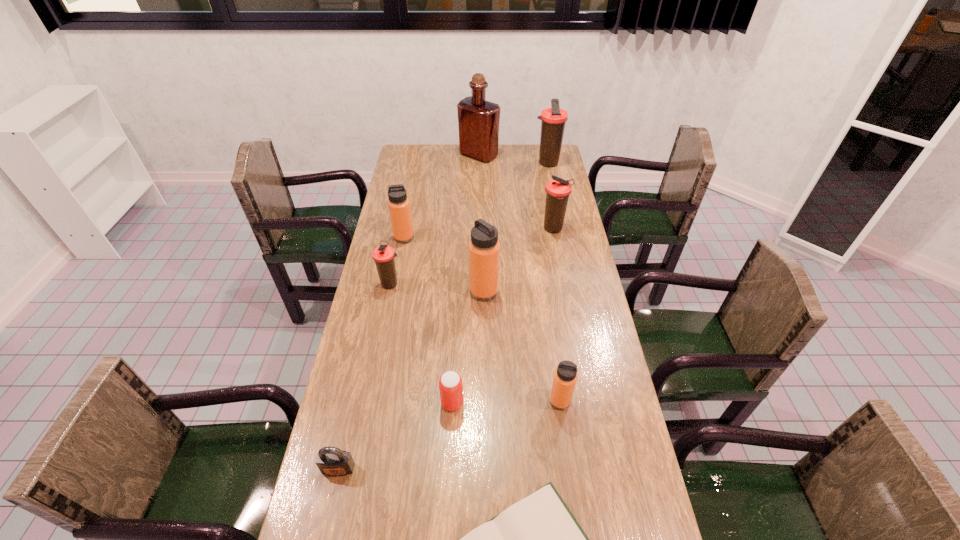
Where is `the third closest thermos bottle to the shortest object`? The height and width of the screenshot is (540, 960). the third closest thermos bottle to the shortest object is located at coordinates (383, 255).

This screenshot has width=960, height=540. I want to click on the fifth closest thermos bottle to the tallest object, so click(x=484, y=248).

Locate which brown thermos bottle ranks second in proximity to the nearest thermos bottle. Please provide its 2D coordinates. Your answer should be formatted as a tuple, i.e. [(x, y)], where the tuple contains the x and y coordinates of a point satisfying the conditions above.

[(558, 190)]

Select which brown thermos bottle is the closest to the hardback book. Please provide its 2D coordinates. Your answer should be formatted as a tuple, i.e. [(x, y)], where the tuple contains the x and y coordinates of a point satisfying the conditions above.

[(383, 255)]

Choose which orange thermos bottle is the second nearest neighbor to the smallest orange thermos bottle. Please provide its 2D coordinates. Your answer should be formatted as a tuple, i.e. [(x, y)], where the tuple contains the x and y coordinates of a point satisfying the conditions above.

[(399, 207)]

Where is `orange thermos bottle that is the third closest one to the second farthest brown thermos bottle`? The image size is (960, 540). orange thermos bottle that is the third closest one to the second farthest brown thermos bottle is located at coordinates (565, 376).